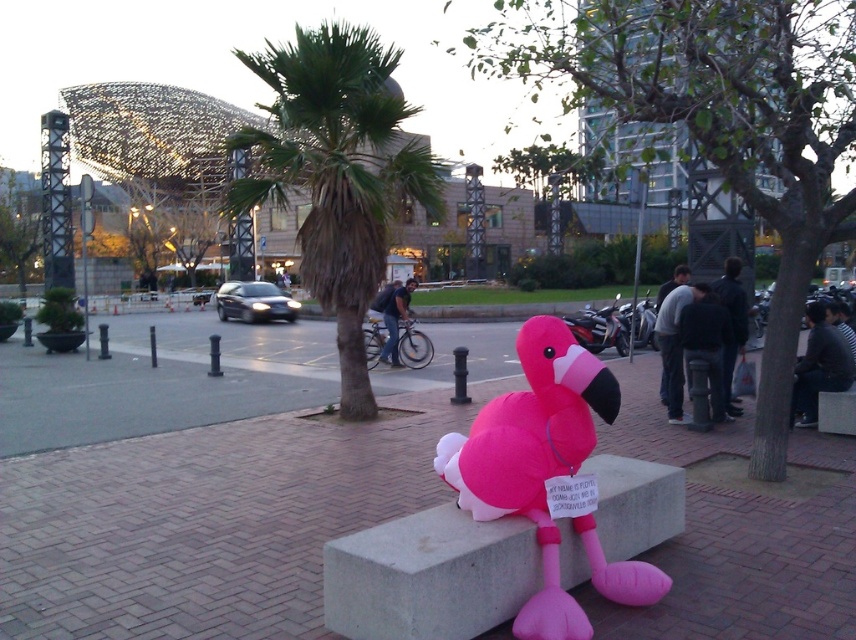
Can you confirm if green leafy palm tree at center is positioned below pink inflatable flamingo at center?

No, green leafy palm tree at center is not below pink inflatable flamingo at center.

Who is more forward, (313, 264) or (548, 374)?

Point (548, 374) is more forward.

Does point (360, 147) come behind point (580, 612)?

That is True.

Locate an element on the screen. green leafy palm tree at center is located at coordinates (337, 172).

Between pink rubber flamingo at center and green leafy palm tree at center, which one has more height?

With more height is green leafy palm tree at center.

Does pink rubber flamingo at center have a smaller size compared to green leafy palm tree at center?

Yes.

Between point (150, 499) and point (397, 196), which one is positioned behind?

The point (397, 196) is more distant.

Locate an element on the screen. The width and height of the screenshot is (856, 640). pink rubber flamingo at center is located at coordinates (218, 515).

Between pink rubber flamingo at center and pink inflatable flamingo at center, which one has more height?

pink inflatable flamingo at center

Can you confirm if pink rubber flamingo at center is wider than pink inflatable flamingo at center?

Yes.

Is point (122, 332) positioned before point (539, 465)?

No.

I want to click on pink rubber flamingo at center, so click(218, 515).